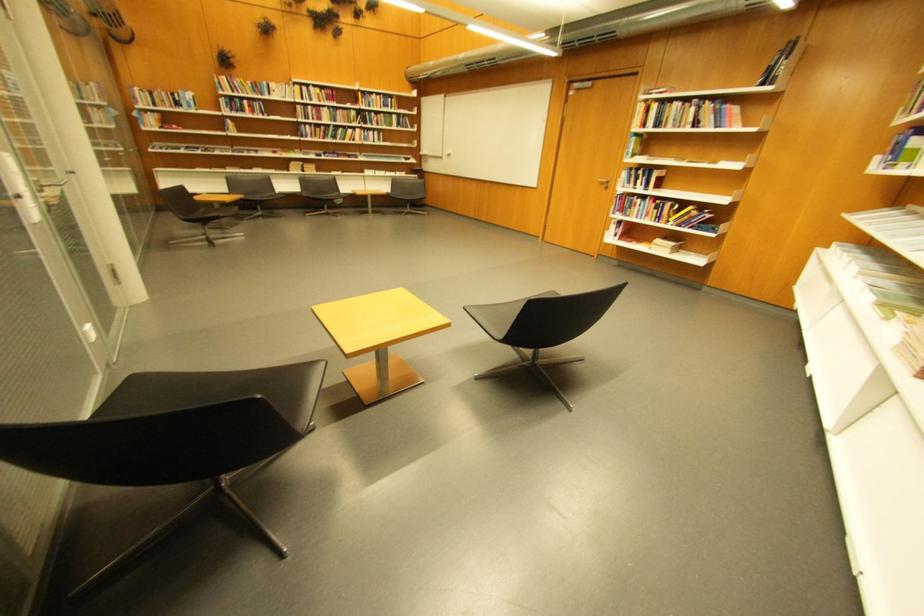
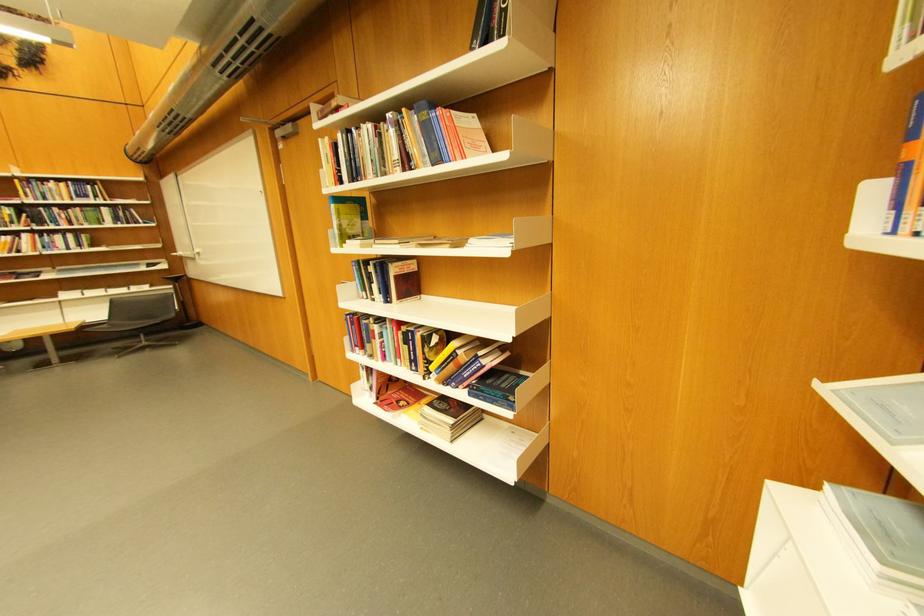
Locate, in the second image, the point that corresponds to (439,156) in the first image.

(195, 257)